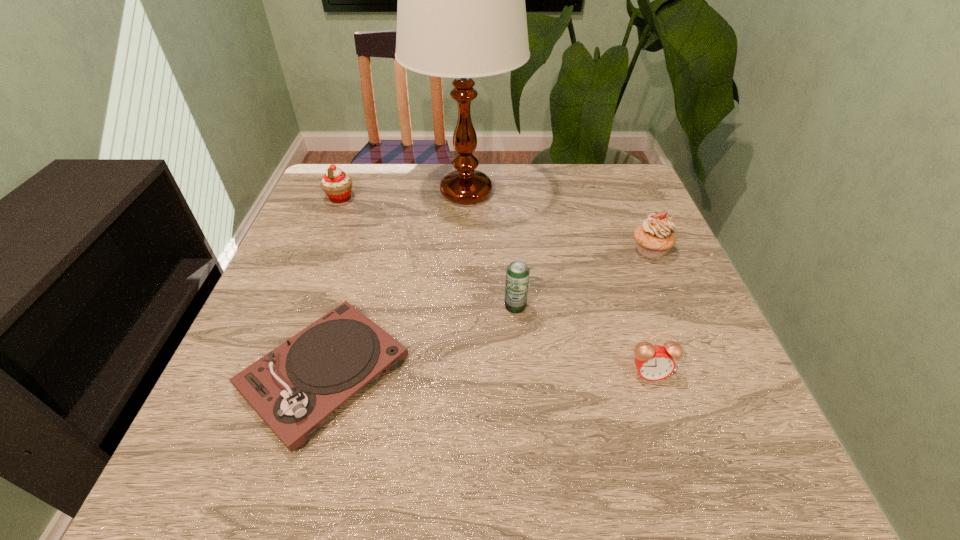
The image size is (960, 540). In order to click on table lamp in this screenshot , I will do (x=461, y=13).

You are a GUI agent. You are given a task and a screenshot of the screen. Output one action in this format:
    pyautogui.click(x=<x>, y=<y>)
    Task: Click on the farther cupcake
    The image size is (960, 540).
    Given the screenshot: What is the action you would take?
    pyautogui.click(x=337, y=185)

At what (x,y) coordinates should I click in order to perform the action: click on beer can. Please return your answer as a coordinate pair (x, y). Looking at the image, I should click on (517, 273).

In order to click on the third farthest object in this screenshot , I will do `click(654, 237)`.

Identify the location of the nearer cupcake. This screenshot has height=540, width=960. (654, 237).

Identify the location of the second object from right to left. The height and width of the screenshot is (540, 960). (654, 362).

Find the location of a particular element. The height and width of the screenshot is (540, 960). the shortest object is located at coordinates (293, 388).

Locate an element on the screen. vacant space located 0.290m on the front of the table lamp is located at coordinates coord(462,309).

Identify the location of free location located on the right of the farther cupcake. The width and height of the screenshot is (960, 540). (398, 198).

Locate an element on the screen. free space located on the left of the beer can is located at coordinates (433, 306).